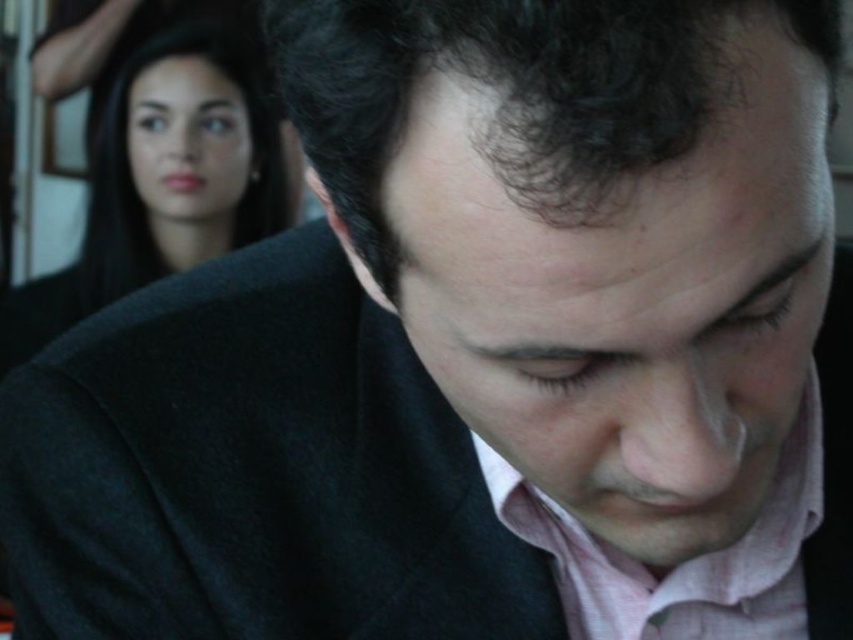
Question: Is smooth black hair at upper left above pink textured dress shirt at center?

Choices:
 (A) no
 (B) yes

Answer: (B)

Question: Is the position of smooth black hair at upper left less distant than that of pink textured dress shirt at center?

Choices:
 (A) yes
 (B) no

Answer: (B)

Question: Can you confirm if smooth black hair at upper left is thinner than pink textured dress shirt at center?

Choices:
 (A) yes
 (B) no

Answer: (B)

Question: Which object is closer to the camera taking this photo?

Choices:
 (A) smooth black hair at upper left
 (B) pink textured dress shirt at center

Answer: (B)

Question: Which object is farther from the camera taking this photo?

Choices:
 (A) pink textured dress shirt at center
 (B) smooth black hair at upper left

Answer: (B)